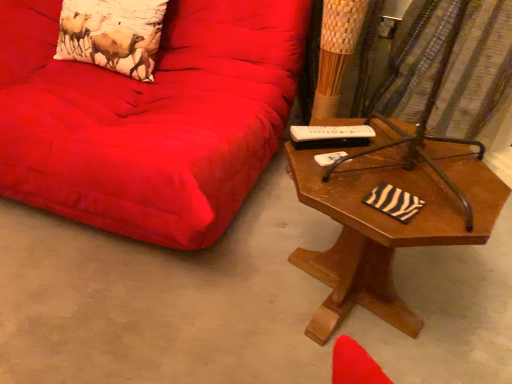
Question: Is suede red couch at upper left bigger or smaller than brown metal swivel chair at right?

Choices:
 (A) big
 (B) small

Answer: (A)

Question: In terms of height, does suede red couch at upper left look taller or shorter compared to brown metal swivel chair at right?

Choices:
 (A) tall
 (B) short

Answer: (A)

Question: Based on their relative distances, which object is farther from the brown wooden table at right?

Choices:
 (A) brown wooden table at right
 (B) brown metal swivel chair at right
 (C) suede red couch at upper left
 (D) printed fabric pillow at upper left

Answer: (D)

Question: Estimate the real-world distances between objects in this image. Which object is farther from the printed fabric pillow at upper left?

Choices:
 (A) brown metal swivel chair at right
 (B) brown wooden table at right
 (C) brown wooden table at right
 (D) suede red couch at upper left

Answer: (A)